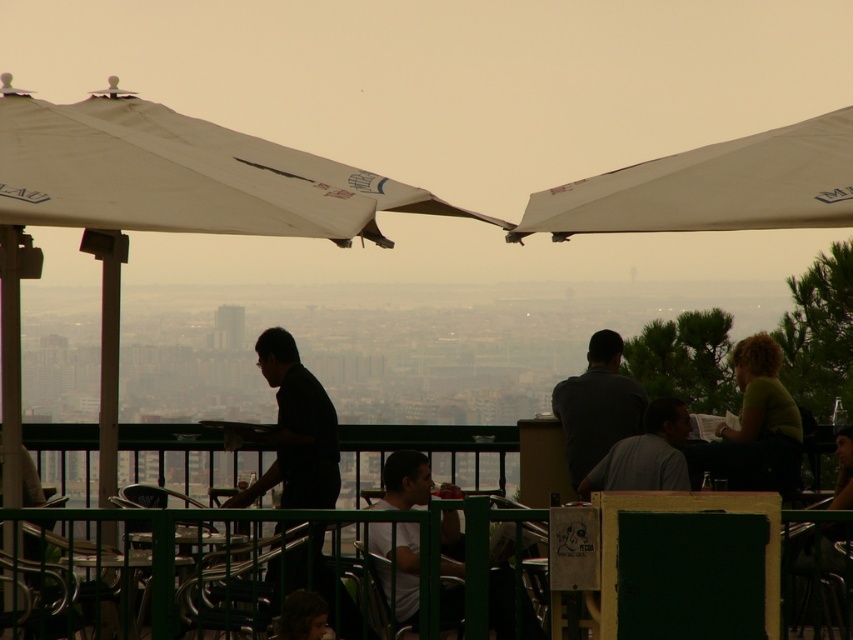
Does gray matte shirt at center appear on the right side of green metal table at lower left?

Indeed, gray matte shirt at center is positioned on the right side of green metal table at lower left.

Between gray matte shirt at center and green metal table at lower left, which one is positioned lower?

green metal table at lower left is lower down.

Is point (683, 484) behind point (148, 563)?

Yes, point (683, 484) is farther from viewer.

Image resolution: width=853 pixels, height=640 pixels. Identify the location of gray matte shirt at center. (646, 454).

Can you confirm if black matte shirt at center is smaller than green matte shirt at right?

Yes, black matte shirt at center is smaller than green matte shirt at right.

Who is taller, black matte shirt at center or green matte shirt at right?

With more height is black matte shirt at center.

Does point (328, 573) lie behind point (764, 404)?

No, (328, 573) is in front of (764, 404).

Where is `black matte shirt at center`? This screenshot has height=640, width=853. black matte shirt at center is located at coordinates (294, 432).

Between white matte shirt at center and green matte shirt at right, which one appears on the left side from the viewer's perspective?

white matte shirt at center

You are a GUI agent. You are given a task and a screenshot of the screen. Output one action in this format:
    pyautogui.click(x=<x>, y=<y>)
    Task: Click on the white matte shirt at center
    The width and height of the screenshot is (853, 640).
    Given the screenshot: What is the action you would take?
    pyautogui.click(x=405, y=481)

Locate an element on the screen. white matte shirt at center is located at coordinates 405,481.